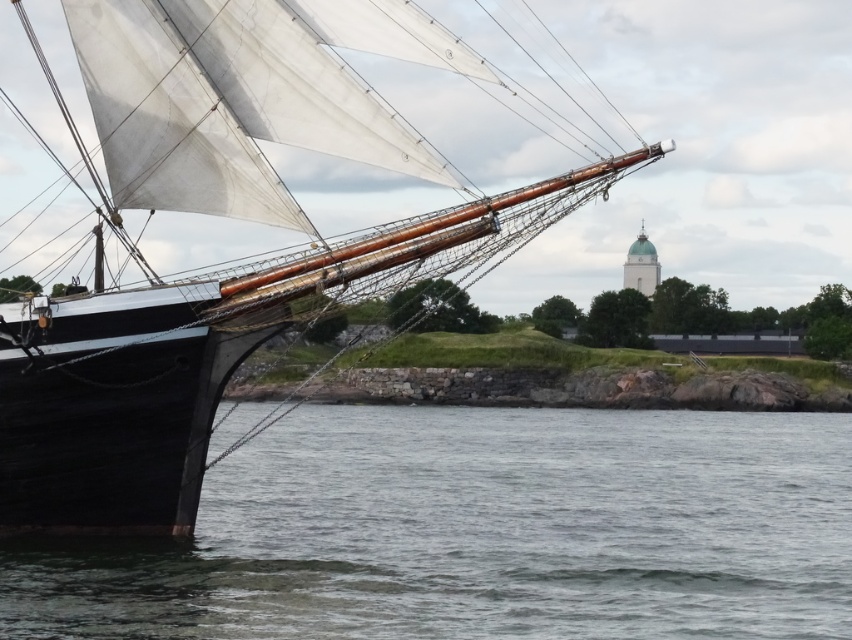
Can you confirm if clear water at lower left is positioned above white canvas sail at left?

Incorrect, clear water at lower left is not positioned above white canvas sail at left.

Which is behind, point (285, 625) or point (410, 4)?

Point (410, 4)

Locate an element on the screen. The width and height of the screenshot is (852, 640). clear water at lower left is located at coordinates (481, 532).